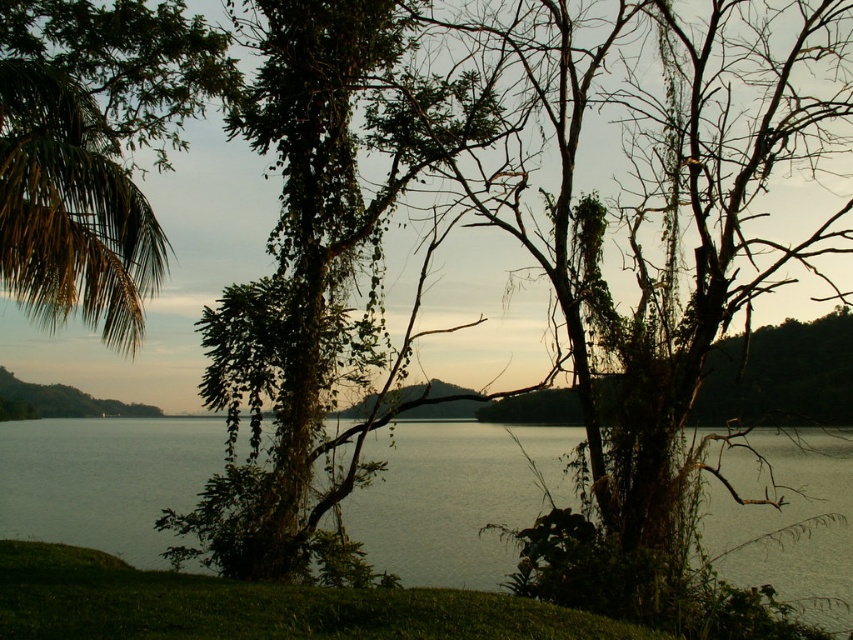
Question: Can you confirm if greenish water at center is smaller than green leafy palm at upper left?

Choices:
 (A) yes
 (B) no

Answer: (A)

Question: Does greenish water at center appear on the left side of green leafy palm at upper left?

Choices:
 (A) no
 (B) yes

Answer: (A)

Question: Does greenish water at center have a greater width compared to green leafy palm at upper left?

Choices:
 (A) no
 (B) yes

Answer: (B)

Question: Which point appears closest to the camera in this image?

Choices:
 (A) (1, 248)
 (B) (775, 525)

Answer: (B)

Question: Which of the following is the closest to the observer?

Choices:
 (A) (724, 548)
 (B) (131, 269)

Answer: (A)